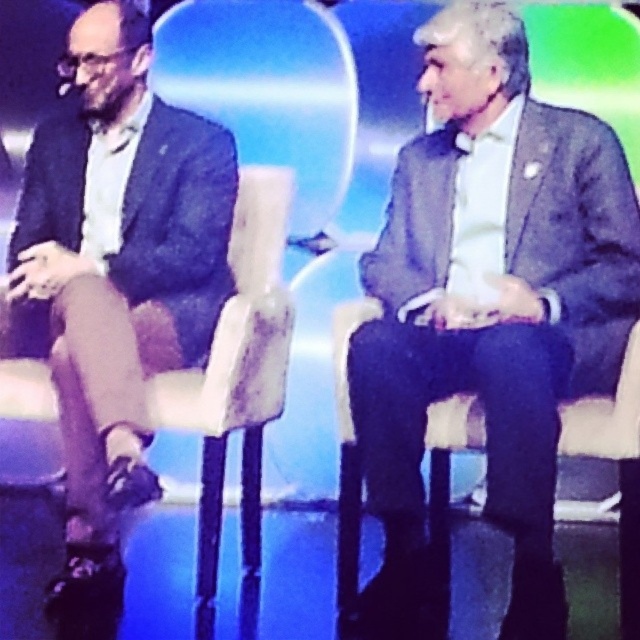
Between point (444, 275) and point (182, 376), which one is positioned in front?

Point (444, 275) is more forward.

The image size is (640, 640). Describe the element at coordinates (490, 305) in the screenshot. I see `matte gray suit at center` at that location.

Between point (513, 120) and point (208, 419), which one is positioned behind?

Positioned behind is point (513, 120).

Where is `matte gray suit at center`? The height and width of the screenshot is (640, 640). matte gray suit at center is located at coordinates (490, 305).

Can you confirm if matte gray suit at center is wider than dark blue textured suit at left?

Yes.

Who is more forward, (513, 12) or (209, 268)?

Point (513, 12) is in front.

This screenshot has height=640, width=640. In order to click on matte gray suit at center in this screenshot , I will do `click(490, 305)`.

Between dark blue textured suit at left and leather textured chair at left, which one appears on the left side from the viewer's perspective?

From the viewer's perspective, dark blue textured suit at left appears more on the left side.

Is dark blue textured suit at left taller than leather textured chair at left?

Incorrect, dark blue textured suit at left's height is not larger of leather textured chair at left's.

Which is in front, point (179, 244) or point (273, 243)?

Point (179, 244) is in front.

Locate an element on the screen. The image size is (640, 640). dark blue textured suit at left is located at coordinates (179, 224).